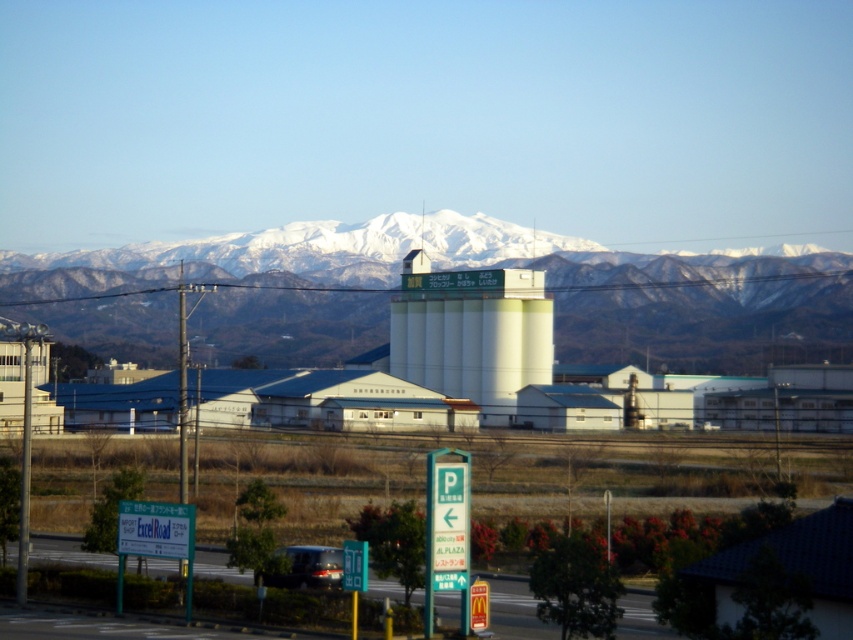
Question: Does white matte water tower at center have a lesser width compared to green plastic sign at lower center?

Choices:
 (A) yes
 (B) no

Answer: (B)

Question: Which object is closer to the camera taking this photo?

Choices:
 (A) white matte water tower at center
 (B) green plastic sign at lower center
 (C) matte black car at lower center

Answer: (B)

Question: Is white snow-covered mountain range at upper center positioned at the back of white matte water tower at center?

Choices:
 (A) yes
 (B) no

Answer: (B)

Question: Is white snow-covered mountain range at upper center positioned behind white matte water tower at center?

Choices:
 (A) yes
 (B) no

Answer: (B)

Question: Which is nearer to the white snow-covered mountain range at upper center?

Choices:
 (A) green plastic sign at lower center
 (B) white matte water tower at center

Answer: (B)

Question: Which of the following is the farthest from the observer?

Choices:
 (A) (480, 371)
 (B) (437, 477)

Answer: (A)